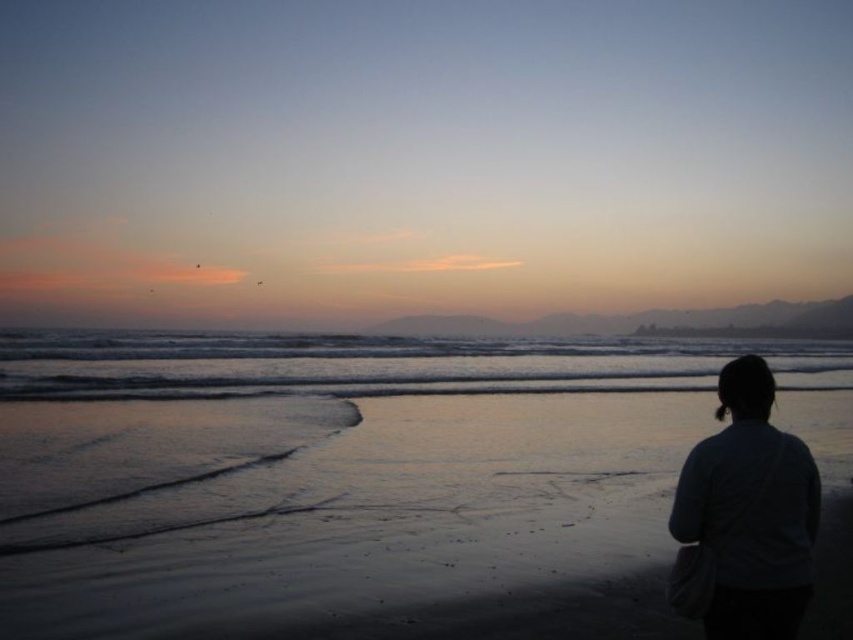
Does shiny golden water at center have a larger size compared to dark gray sweater at lower right?

Yes, shiny golden water at center is bigger than dark gray sweater at lower right.

Is the position of shiny golden water at center less distant than that of dark gray sweater at lower right?

No.

The width and height of the screenshot is (853, 640). What are the coordinates of `shiny golden water at center` in the screenshot? It's located at (384, 364).

You are a GUI agent. You are given a task and a screenshot of the screen. Output one action in this format:
    pyautogui.click(x=<x>, y=<y>)
    Task: Click on the shiny golden water at center
    The width and height of the screenshot is (853, 640).
    Given the screenshot: What is the action you would take?
    pyautogui.click(x=384, y=364)

Which of these two, smooth sand at lower right or dark gray sweater at lower right, stands taller?

smooth sand at lower right

Is point (254, 570) in front of point (780, 561)?

No, (254, 570) is further to viewer.

Identify the location of smooth sand at lower right. (387, 532).

I want to click on smooth sand at lower right, so click(387, 532).

Does smooth sand at lower right appear on the left side of shiny golden water at center?

No, smooth sand at lower right is not to the left of shiny golden water at center.

Is point (529, 589) positioned in front of point (511, 353)?

Yes.

The height and width of the screenshot is (640, 853). What are the coordinates of `smooth sand at lower right` in the screenshot? It's located at (387, 532).